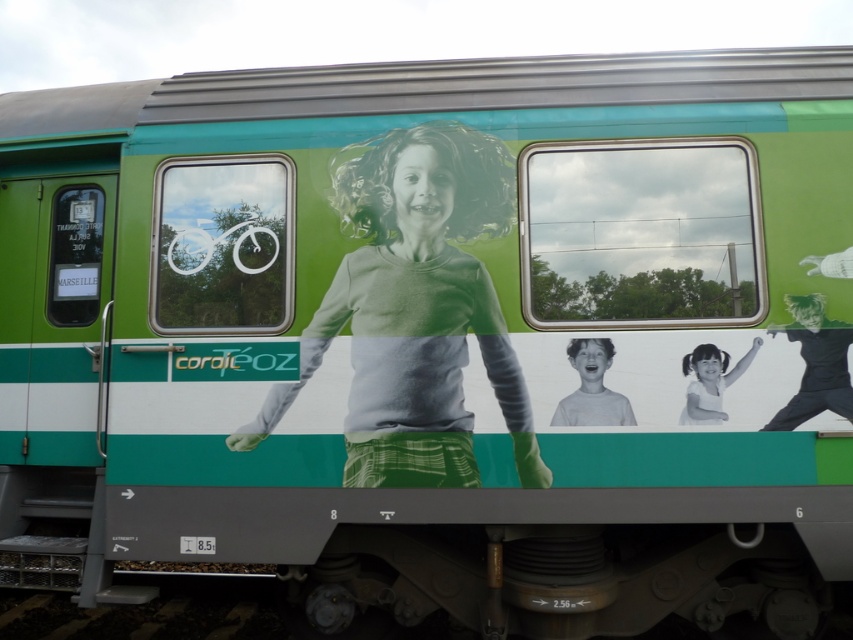
Question: Which object appears closest to the camera in this image?

Choices:
 (A) gray matte shirt at center
 (B) white paper at center
 (C) matte white face at center
 (D) black matte shirt at right

Answer: (D)

Question: Which point is closer to the camera?

Choices:
 (A) (691, 412)
 (B) (508, 362)
 (C) (851, 412)
 (D) (576, 362)

Answer: (C)

Question: Does black matte shirt at right appear on the right side of matte white face at center?

Choices:
 (A) no
 (B) yes

Answer: (B)

Question: Considering the real-world distances, which object is closest to the matte white face at center?

Choices:
 (A) white paper at center
 (B) black matte shirt at right

Answer: (A)

Question: Is matte white face at center bigger than white paper at center?

Choices:
 (A) no
 (B) yes

Answer: (B)

Question: Can you confirm if gray matte shirt at center is positioned below matte white face at center?

Choices:
 (A) yes
 (B) no

Answer: (B)